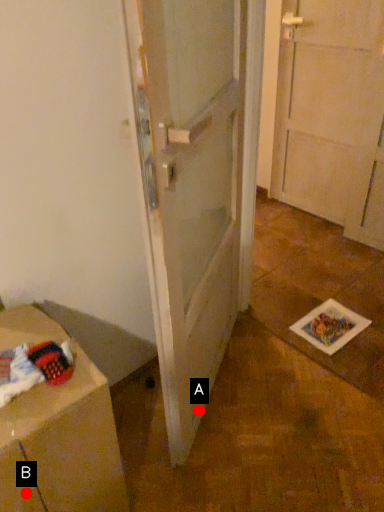
Question: Two points are circled on the image, labeled by A and B beside each circle. Which point is closer to the camera?

Choices:
 (A) A is closer
 (B) B is closer

Answer: (B)